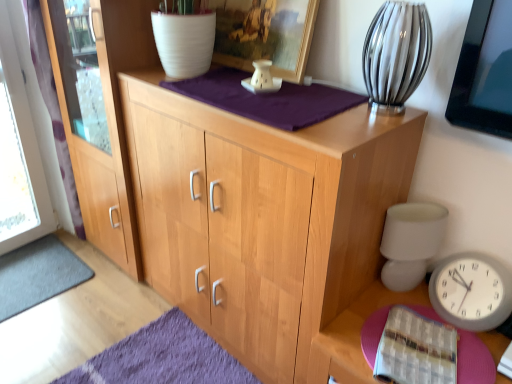
Question: Considering the relative sizes of matte wood screen door at left and white matte table lamp at right in the image provided, is matte wood screen door at left bigger than white matte table lamp at right?

Choices:
 (A) no
 (B) yes

Answer: (B)

Question: Is matte wood screen door at left facing towards white matte table lamp at right?

Choices:
 (A) no
 (B) yes

Answer: (B)

Question: Is the depth of matte wood screen door at left greater than that of white matte table lamp at right?

Choices:
 (A) yes
 (B) no

Answer: (A)

Question: Does matte wood screen door at left have a lesser height compared to white matte table lamp at right?

Choices:
 (A) yes
 (B) no

Answer: (B)

Question: Considering the relative sizes of matte wood screen door at left and white matte table lamp at right in the image provided, is matte wood screen door at left smaller than white matte table lamp at right?

Choices:
 (A) yes
 (B) no

Answer: (B)

Question: Looking at the image, does white matte table lamp at right seem bigger or smaller compared to wooden picture frame at upper center?

Choices:
 (A) small
 (B) big

Answer: (A)

Question: Is point (411, 279) positioned closer to the camera than point (247, 18)?

Choices:
 (A) farther
 (B) closer

Answer: (B)

Question: In terms of height, does white matte table lamp at right look taller or shorter compared to wooden picture frame at upper center?

Choices:
 (A) tall
 (B) short

Answer: (B)

Question: In terms of width, does white matte table lamp at right look wider or thinner when compared to wooden picture frame at upper center?

Choices:
 (A) thin
 (B) wide

Answer: (B)

Question: Visually, is natural wood cabinet at center positioned to the left or to the right of matte wood screen door at left?

Choices:
 (A) left
 (B) right

Answer: (B)

Question: From a real-world perspective, is natural wood cabinet at center positioned above or below matte wood screen door at left?

Choices:
 (A) below
 (B) above

Answer: (A)

Question: In the image, is natural wood cabinet at center positioned in front of or behind matte wood screen door at left?

Choices:
 (A) front
 (B) behind

Answer: (A)

Question: From the image's perspective, is natural wood cabinet at center above or below matte wood screen door at left?

Choices:
 (A) below
 (B) above

Answer: (A)

Question: In terms of width, does dark gray carpet at lower left look wider or thinner when compared to clear glass vase at upper right?

Choices:
 (A) wide
 (B) thin

Answer: (A)

Question: Considering the positions of point (22, 299) and point (368, 57), is point (22, 299) closer or farther from the camera than point (368, 57)?

Choices:
 (A) closer
 (B) farther

Answer: (B)